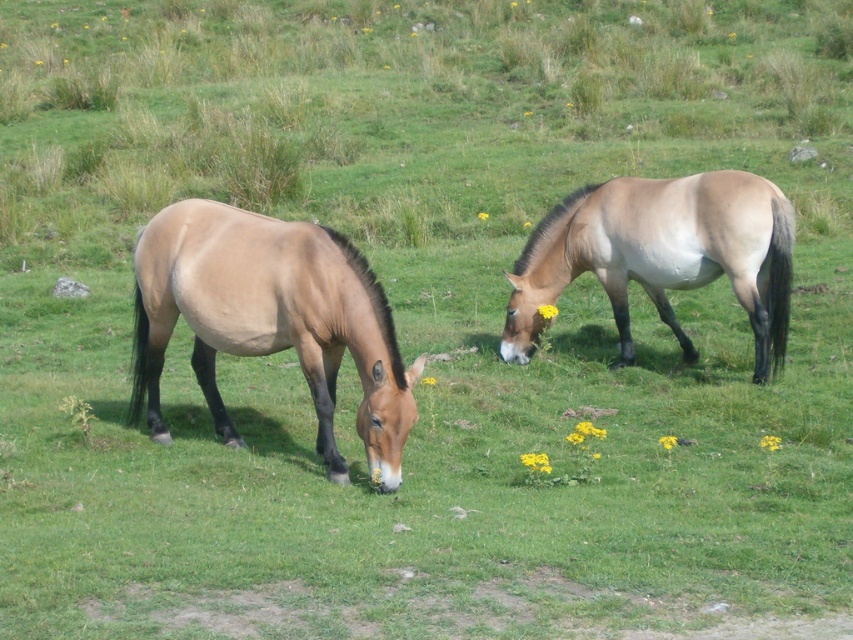
Question: Which of the following is the closest to the observer?

Choices:
 (A) light brown glossy horse at right
 (B) brown matte horse at left

Answer: (B)

Question: Does brown matte horse at left come behind light brown glossy horse at right?

Choices:
 (A) yes
 (B) no

Answer: (B)

Question: Which point is farther to the camera?

Choices:
 (A) brown matte horse at left
 (B) light brown glossy horse at right

Answer: (B)

Question: Does brown matte horse at left have a lesser width compared to light brown glossy horse at right?

Choices:
 (A) yes
 (B) no

Answer: (B)

Question: Does brown matte horse at left appear on the left side of light brown glossy horse at right?

Choices:
 (A) no
 (B) yes

Answer: (B)